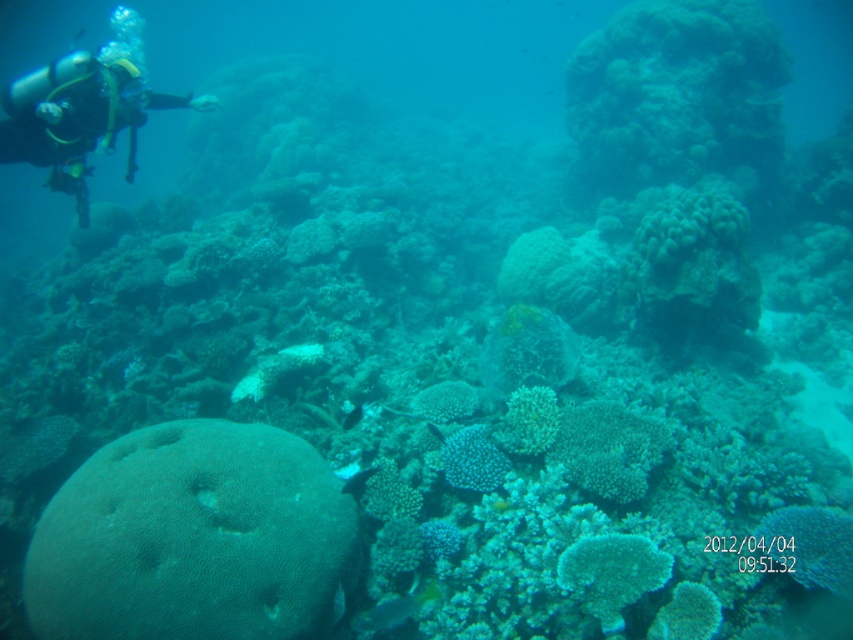
Question: Which point appears farthest from the camera in this image?

Choices:
 (A) (544, 433)
 (B) (495, 456)
 (C) (648, 456)
 (D) (128, 145)

Answer: (D)

Question: Is matte black scuba diver at upper left below translucent white coral at center?

Choices:
 (A) yes
 (B) no

Answer: (B)

Question: Is matte black scuba diver at upper left below spotted coral at center?

Choices:
 (A) yes
 (B) no

Answer: (B)

Question: Among these points, which one is nearest to the camera?

Choices:
 (A) (93, 76)
 (B) (410, 592)

Answer: (B)

Question: Which point is closer to the camera?

Choices:
 (A) (328, 580)
 (B) (376, 630)
 (C) (473, 426)

Answer: (A)

Question: Does white coral at center appear on the left side of spotted coral at center?

Choices:
 (A) no
 (B) yes

Answer: (A)